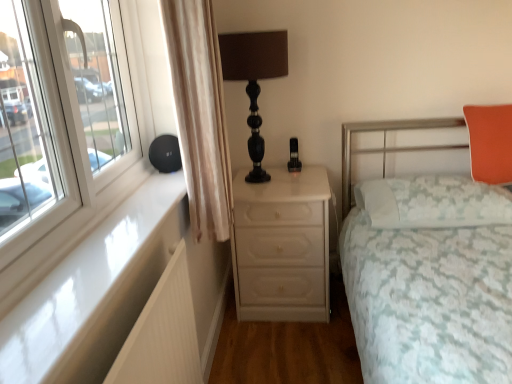
Question: Does beige fabric curtain at left have a greater width compared to white glossy chest of drawers at center?

Choices:
 (A) yes
 (B) no

Answer: (B)

Question: From a real-world perspective, is beige fabric curtain at left below white glossy chest of drawers at center?

Choices:
 (A) no
 (B) yes

Answer: (A)

Question: Is beige fabric curtain at left to the left of white glossy chest of drawers at center from the viewer's perspective?

Choices:
 (A) yes
 (B) no

Answer: (A)

Question: Are beige fabric curtain at left and white glossy chest of drawers at center making contact?

Choices:
 (A) no
 (B) yes

Answer: (A)

Question: Does beige fabric curtain at left have a lesser width compared to white glossy chest of drawers at center?

Choices:
 (A) yes
 (B) no

Answer: (A)

Question: Is beige fabric curtain at left at the right side of white glossy chest of drawers at center?

Choices:
 (A) yes
 (B) no

Answer: (B)

Question: From the image's perspective, is white glossy chest of drawers at center located beneath white ribbed radiator at lower left?

Choices:
 (A) yes
 (B) no

Answer: (B)

Question: Does white glossy chest of drawers at center have a smaller size compared to white ribbed radiator at lower left?

Choices:
 (A) no
 (B) yes

Answer: (A)

Question: Is white glossy chest of drawers at center not inside white ribbed radiator at lower left?

Choices:
 (A) no
 (B) yes

Answer: (B)

Question: Is white glossy chest of drawers at center in front of white ribbed radiator at lower left?

Choices:
 (A) yes
 (B) no

Answer: (B)

Question: Does white glossy chest of drawers at center lie behind white ribbed radiator at lower left?

Choices:
 (A) no
 (B) yes

Answer: (B)

Question: Is white glossy chest of drawers at center at the left side of white ribbed radiator at lower left?

Choices:
 (A) yes
 (B) no

Answer: (B)

Question: Does white lace pillow at right, which is the second pillow in top-to-bottom order, have a greater width compared to beige fabric curtain at left?

Choices:
 (A) yes
 (B) no

Answer: (A)